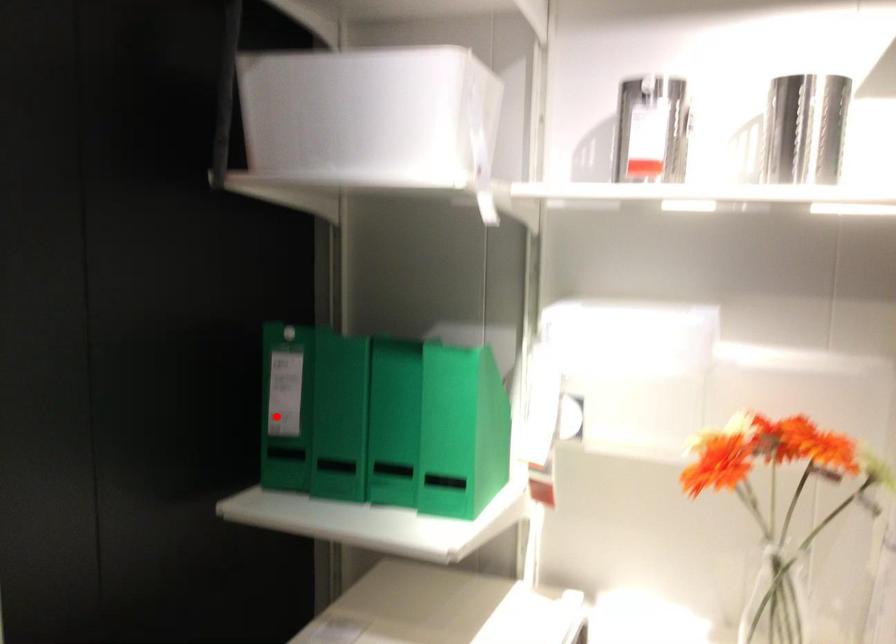
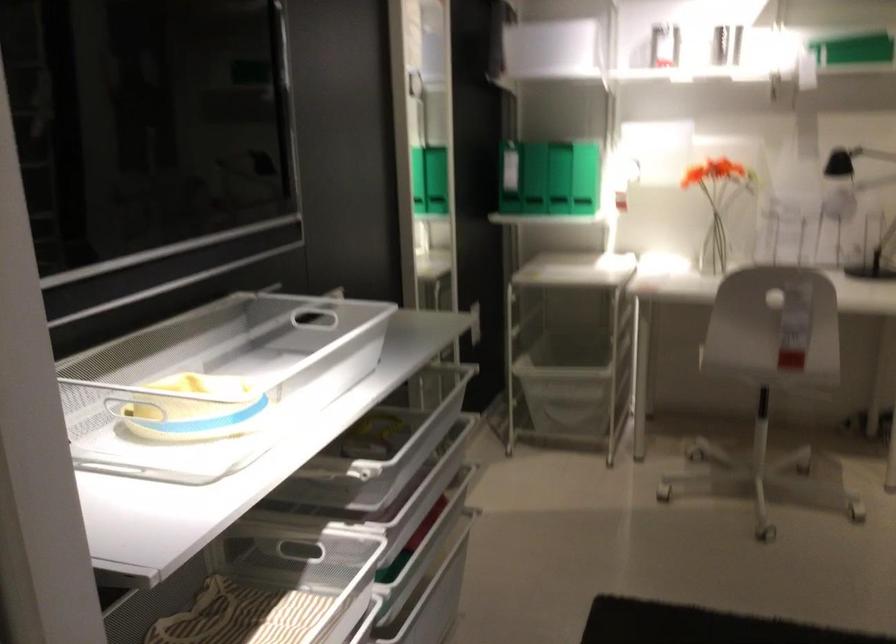
Question: I am providing you with two images of the same scene from different viewpoints. In image1, a red point is highlighted. Considering the same 3D point in image2, which of the following is correct?

Choices:
 (A) It is closer
 (B) It is farther

Answer: (B)